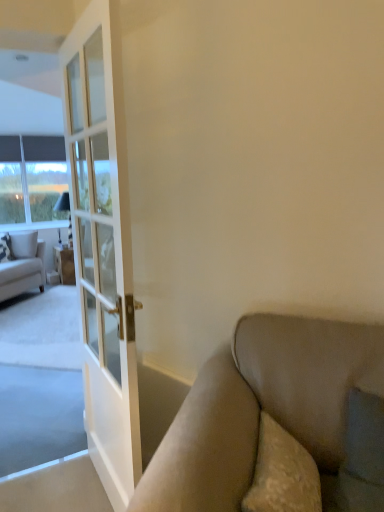
Question: From a real-world perspective, is white textured pillow at left, which ranks as the 1th pillow in right-to-left order, over matte white cabinet at left?

Choices:
 (A) yes
 (B) no

Answer: (A)

Question: Would you consider white textured pillow at left, the 2th pillow from the left, to be distant from matte white cabinet at left?

Choices:
 (A) yes
 (B) no

Answer: (B)

Question: Is white textured pillow at left, which ranks as the 1th pillow in right-to-left order, looking in the opposite direction of matte white cabinet at left?

Choices:
 (A) yes
 (B) no

Answer: (A)

Question: Is white textured pillow at left, which ranks as the 1th pillow in right-to-left order, aimed at matte white cabinet at left?

Choices:
 (A) no
 (B) yes

Answer: (A)

Question: Does white textured pillow at left, the 2th pillow from the left, have a greater width compared to matte white cabinet at left?

Choices:
 (A) yes
 (B) no

Answer: (B)

Question: Considering the relative sizes of white textured pillow at left, the 2th pillow from the left, and matte white cabinet at left in the image provided, is white textured pillow at left, the 2th pillow from the left, taller than matte white cabinet at left?

Choices:
 (A) no
 (B) yes

Answer: (A)

Question: Would you say light beige fabric couch at left is a long distance from clear glass window at left?

Choices:
 (A) no
 (B) yes

Answer: (A)

Question: Would you say clear glass window at left is part of light beige fabric couch at left's contents?

Choices:
 (A) no
 (B) yes

Answer: (A)

Question: Is light beige fabric couch at left thinner than clear glass window at left?

Choices:
 (A) yes
 (B) no

Answer: (B)

Question: From the image's perspective, is light beige fabric couch at left located above clear glass window at left?

Choices:
 (A) no
 (B) yes

Answer: (A)

Question: Is light beige fabric couch at left looking in the opposite direction of clear glass window at left?

Choices:
 (A) yes
 (B) no

Answer: (B)

Question: Would you say light beige fabric couch at left is outside clear glass window at left?

Choices:
 (A) yes
 (B) no

Answer: (A)

Question: Is patterned fabric pillow at left, acting as the first pillow starting from the left, turned away from matte white cabinet at left?

Choices:
 (A) yes
 (B) no

Answer: (B)